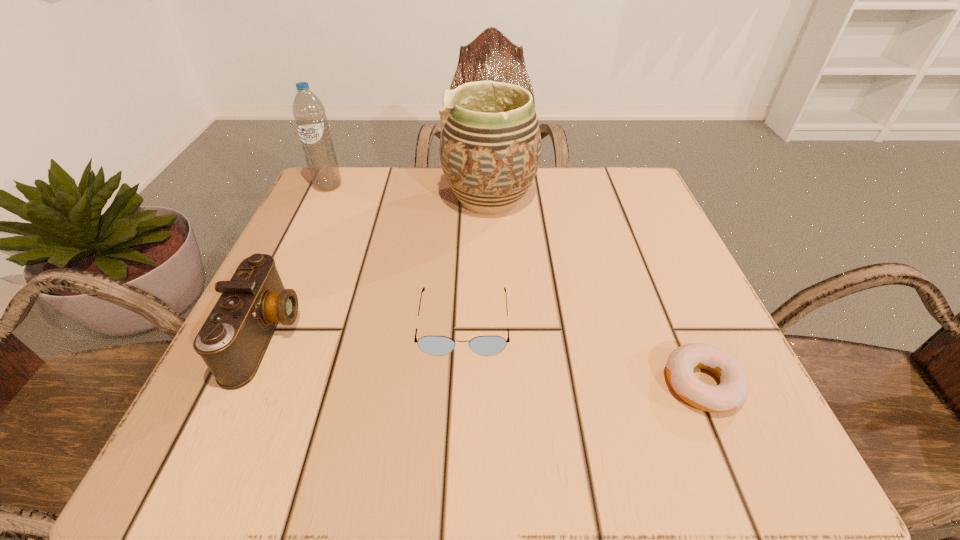
Where is `free region at the near edge`? free region at the near edge is located at coordinates (323, 456).

Image resolution: width=960 pixels, height=540 pixels. I want to click on vacant point at the left edge, so click(x=315, y=278).

This screenshot has height=540, width=960. I want to click on free space at the right edge of the desktop, so click(x=727, y=345).

This screenshot has height=540, width=960. Find the location of `vacant area at the far left corner`. vacant area at the far left corner is located at coordinates (385, 168).

The width and height of the screenshot is (960, 540). Find the location of `blank space at the far right corner of the desktop`. blank space at the far right corner of the desktop is located at coordinates (584, 190).

At what (x,y) coordinates should I click in order to perform the action: click on free space between the rightmost object and the third shortest object. Please return your answer as a coordinate pair (x, y). Image resolution: width=960 pixels, height=540 pixels. Looking at the image, I should click on (485, 360).

Locate an element on the screen. Image resolution: width=960 pixels, height=540 pixels. vacant area that lies between the camera and the second shortest object is located at coordinates (365, 329).

Identify the location of free point between the water bottle and the spectacles. (396, 254).

The image size is (960, 540). What are the coordinates of `vacant region between the pottery and the water bottle` in the screenshot? It's located at (409, 192).

The height and width of the screenshot is (540, 960). What are the coordinates of `free space between the second shortest object and the camera` in the screenshot? It's located at (365, 329).